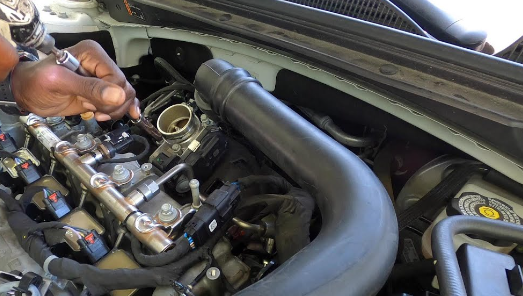
You are a GUI agent. You are given a task and a screenshot of the screen. Output one action in this format:
    pyautogui.click(x=<x>, y=<y>)
    Task: Click on the screws
    Image resolution: width=523 pixels, height=296 pixels.
    Given the screenshot: What is the action you would take?
    [167, 203], [122, 169], [88, 135]